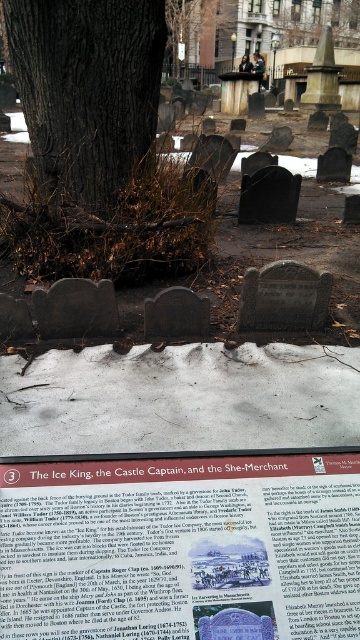
Question: Can you confirm if matte brown sign at center is wider than brown rough bark tree at center?

Choices:
 (A) yes
 (B) no

Answer: (B)

Question: Which object appears closest to the camera in this image?

Choices:
 (A) brown rough bark tree at center
 (B) matte brown sign at center

Answer: (B)

Question: Is matte brown sign at center bigger than brown rough bark tree at center?

Choices:
 (A) yes
 (B) no

Answer: (B)

Question: Is matte brown sign at center to the left of brown rough bark tree at center from the viewer's perspective?

Choices:
 (A) no
 (B) yes

Answer: (A)

Question: Which point appears farthest from the camera in this image?

Choices:
 (A) (120, 140)
 (B) (6, 573)

Answer: (A)